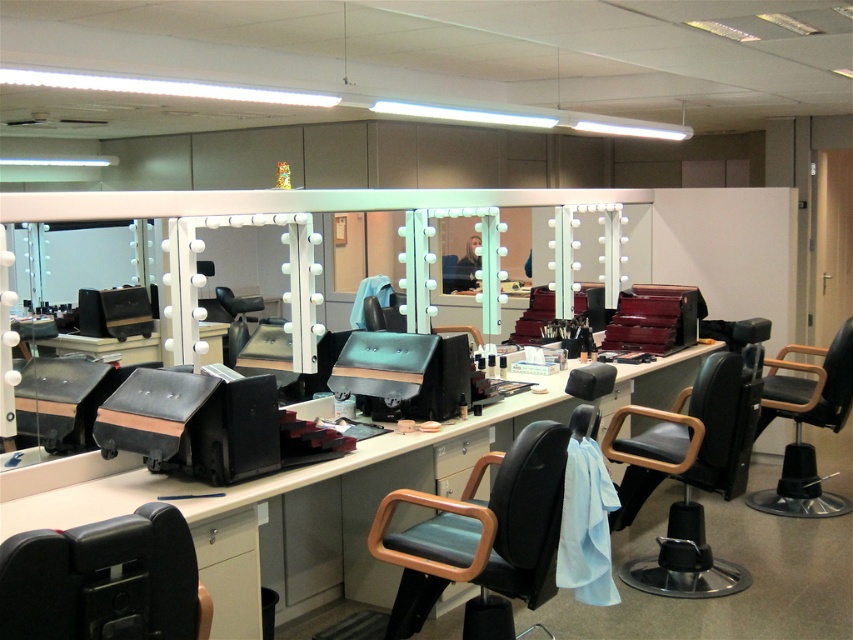
You are a makeup artist preparing for a client. You need to choose between the black matte swivel chair at center and the matte black barber chair at center for a client who requires a chair that allows easy rotation. Which chair should you select?

The black matte swivel chair at center is the appropriate choice because swivel chairs are designed to rotate easily, unlike the matte black barber chair at center which may not have that feature.

You are a makeup artist setting up a workstation. You need to place both the matte black swivel chair at center and the matte black barber chair at center along a narrow corridor. Given the corridor is only 1.2 meters wide, which chair should you choose to ensure it fits comfortably without blocking the pathway?

The matte black barber chair at center has a narrower width compared to the matte black swivel chair at center. Therefore, selecting the matte black barber chair at center ensures it will fit within the 1.2 meters corridor width without obstructing the pathway.

You are a makeup artist standing at the beauty station. You need to move from your current position to retrieve an item located at point (48,609) and then to point (471,285). Which point should you visit first to follow the most efficient path?

You should visit point (48,609) first because it is in front of point (471,285), so reaching it first allows you to proceed efficiently to the second point without backtracking.